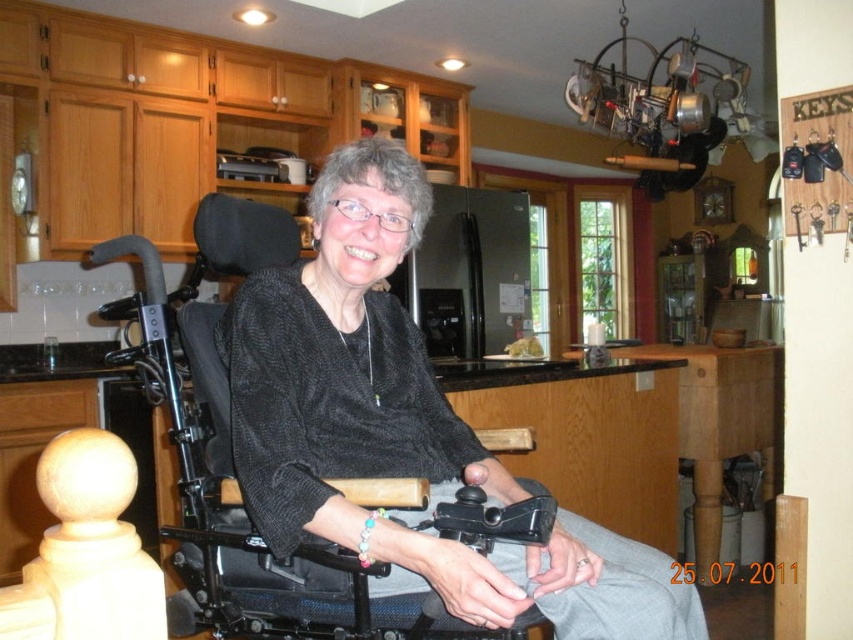
This screenshot has width=853, height=640. Describe the element at coordinates (403, 429) in the screenshot. I see `black mesh wheelchair at center` at that location.

Measure the distance between black mesh wheelchair at center and camera.

A distance of 1.04 meters exists between black mesh wheelchair at center and camera.

This screenshot has height=640, width=853. In order to click on black mesh wheelchair at center in this screenshot , I will do `click(403, 429)`.